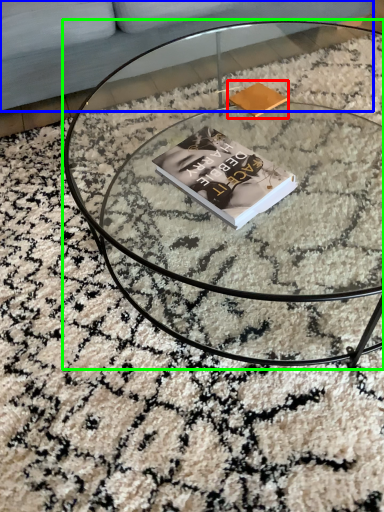
Question: Based on their relative distances, which object is nearer to paperback book (highlighted by a red box)? Choose from couch (highlighted by a blue box) and coffee table (highlighted by a green box).

Choices:
 (A) couch
 (B) coffee table

Answer: (B)